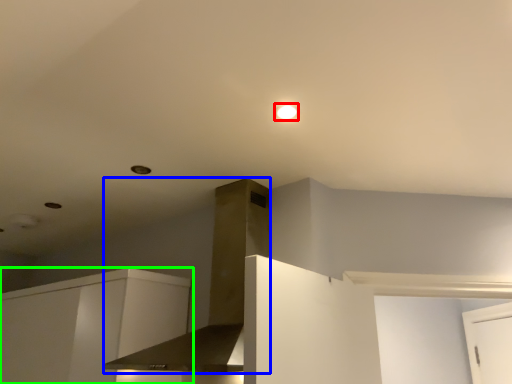
Question: Which object is positioned farthest from lighting (highlighted by a red box)? Select from vent (highlighted by a blue box) and cabinetry (highlighted by a green box).

Choices:
 (A) vent
 (B) cabinetry

Answer: (B)